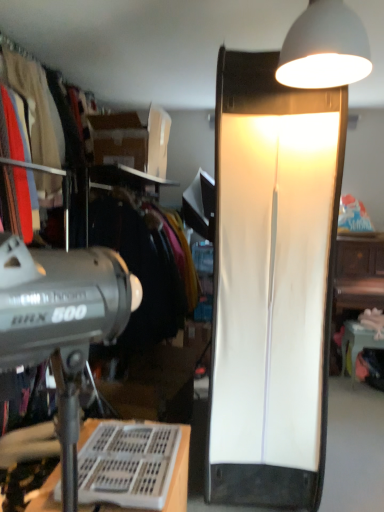
Question: Does white plastic desk at lower left touch white glossy table at lower right?

Choices:
 (A) yes
 (B) no

Answer: (B)

Question: Is white plastic desk at lower left further to camera compared to white glossy table at lower right?

Choices:
 (A) no
 (B) yes

Answer: (A)

Question: Is there a large distance between white plastic desk at lower left and white glossy table at lower right?

Choices:
 (A) no
 (B) yes

Answer: (B)

Question: From the image's perspective, would you say white plastic desk at lower left is shown under white glossy table at lower right?

Choices:
 (A) no
 (B) yes

Answer: (B)

Question: Does white plastic desk at lower left lie in front of white glossy table at lower right?

Choices:
 (A) no
 (B) yes

Answer: (B)

Question: Can you confirm if white plastic desk at lower left is thinner than white glossy table at lower right?

Choices:
 (A) yes
 (B) no

Answer: (B)

Question: From the image's perspective, would you say matte black clothing at upper left, marked as the second clothing in a front-to-back arrangement, is shown under white matte lampshade at upper right, marked as the 1th lamp in a back-to-front arrangement?

Choices:
 (A) no
 (B) yes

Answer: (A)

Question: Can you confirm if matte black clothing at upper left, marked as the first clothing in a back-to-front arrangement, is taller than white matte lampshade at upper right, marked as the 1th lamp in a back-to-front arrangement?

Choices:
 (A) no
 (B) yes

Answer: (A)

Question: Is matte black clothing at upper left, marked as the second clothing in a front-to-back arrangement, at the left side of white matte lampshade at upper right, the 1th lamp when ordered from bottom to top?

Choices:
 (A) no
 (B) yes

Answer: (B)

Question: Is matte black clothing at upper left, marked as the first clothing in a back-to-front arrangement, to the right of white matte lampshade at upper right, the 1th lamp when ordered from bottom to top, from the viewer's perspective?

Choices:
 (A) yes
 (B) no

Answer: (B)

Question: Is matte black clothing at upper left, marked as the first clothing in a back-to-front arrangement, positioned far away from white matte lampshade at upper right, the second lamp viewed from the top?

Choices:
 (A) no
 (B) yes

Answer: (B)

Question: Can you see matte black clothing at upper left, marked as the first clothing in a back-to-front arrangement, touching white matte lampshade at upper right, marked as the 1th lamp in a back-to-front arrangement?

Choices:
 (A) no
 (B) yes

Answer: (A)

Question: From a real-world perspective, is matte black clothing at upper left, marked as the second clothing in a front-to-back arrangement, beneath white glossy table at lower right?

Choices:
 (A) yes
 (B) no

Answer: (B)